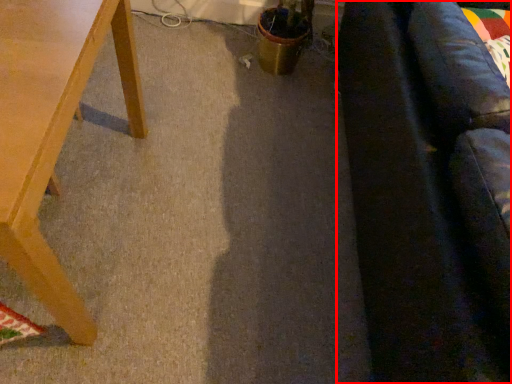
Question: From the image's perspective, what is the correct spatial positioning of couch (annotated by the red box) in reference to table?

Choices:
 (A) below
 (B) above

Answer: (B)